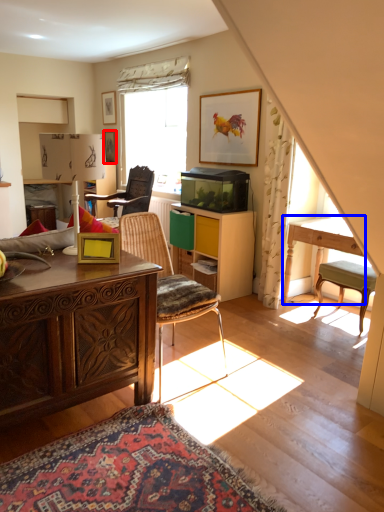
Question: Which point is further to the camera, picture frame (highlighted by a red box) or table (highlighted by a blue box)?

Choices:
 (A) picture frame
 (B) table

Answer: (A)